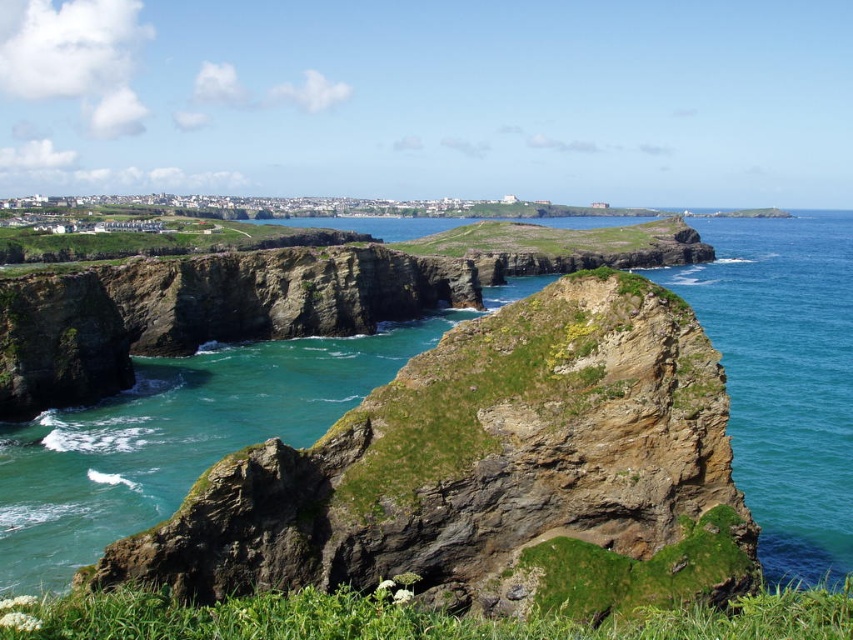
Question: Is brown rocky cliff at center closer to camera compared to greenish-blue water at right?

Choices:
 (A) no
 (B) yes

Answer: (B)

Question: Does brown rocky cliff at center appear on the left side of greenish-blue water at right?

Choices:
 (A) yes
 (B) no

Answer: (A)

Question: Which of the following is the closest to the observer?

Choices:
 (A) (714, 275)
 (B) (651, 488)

Answer: (B)

Question: From the image, what is the correct spatial relationship of brown rocky cliff at center in relation to greenish-blue water at right?

Choices:
 (A) left
 (B) right

Answer: (A)

Question: Which point appears closest to the camera in this image?

Choices:
 (A) (183, 528)
 (B) (821, 248)

Answer: (A)